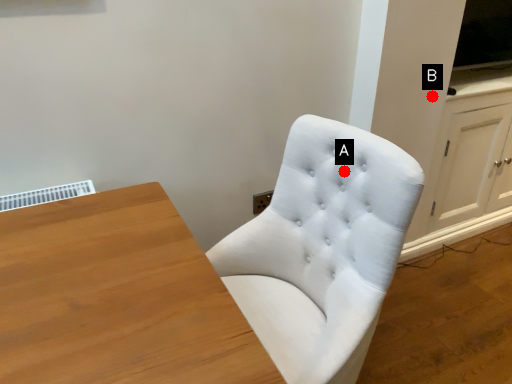
Question: Two points are circled on the image, labeled by A and B beside each circle. Which of the following is the closest to the observer?

Choices:
 (A) A is closer
 (B) B is closer

Answer: (A)